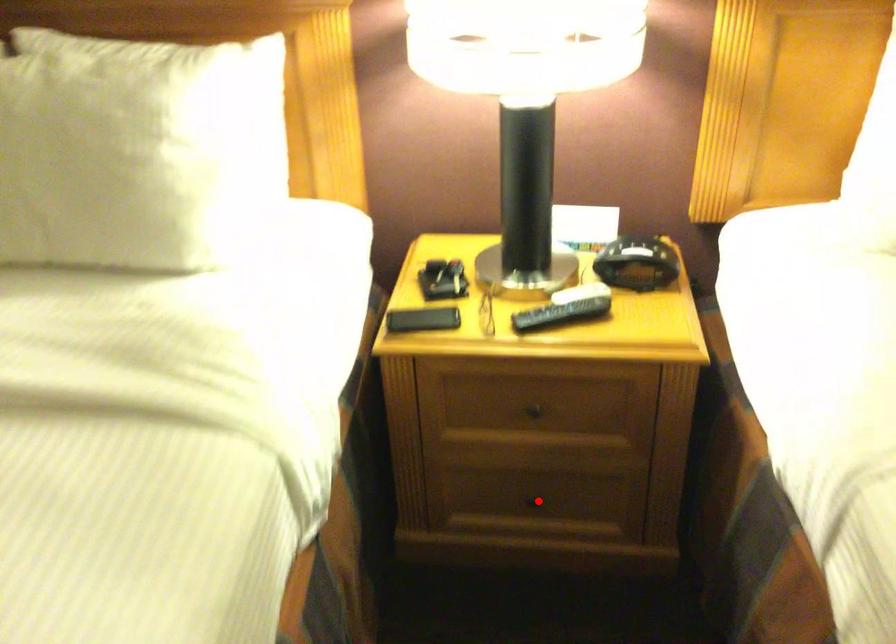
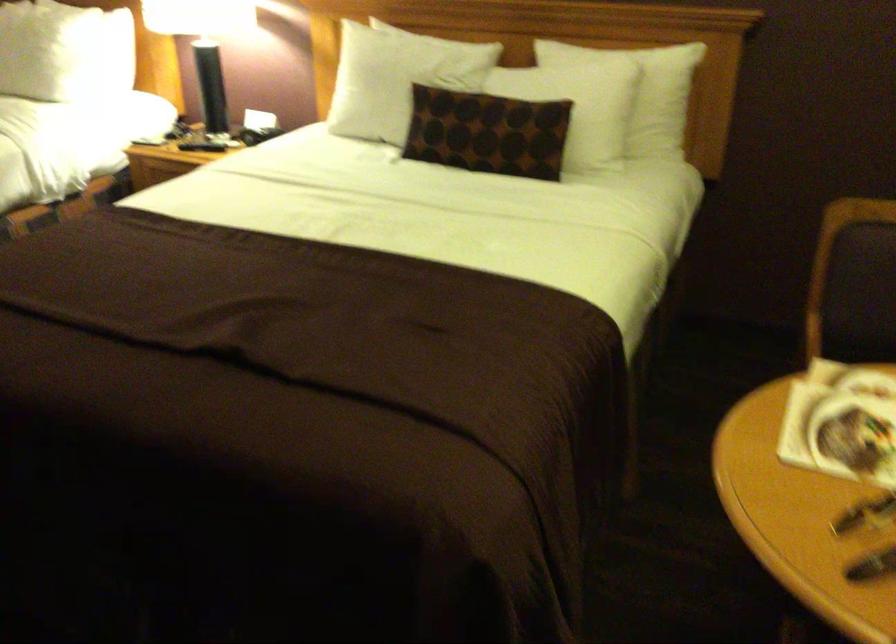
Question: I am providing you with two images of the same scene from different viewpoints. A red point is marked on the first image. Is the red point's position out of view in image 2?

Choices:
 (A) Yes
 (B) No

Answer: (A)